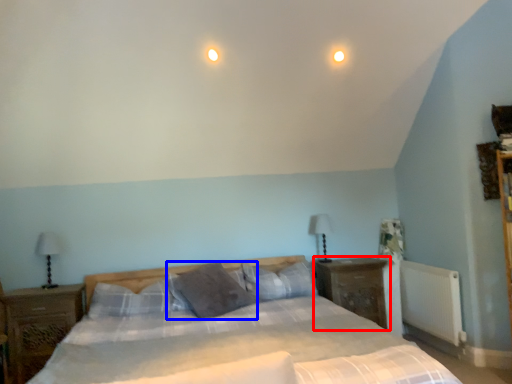
Question: Which object is closer to the camera taking this photo, nightstand (highlighted by a red box) or pillow (highlighted by a blue box)?

Choices:
 (A) nightstand
 (B) pillow

Answer: (B)